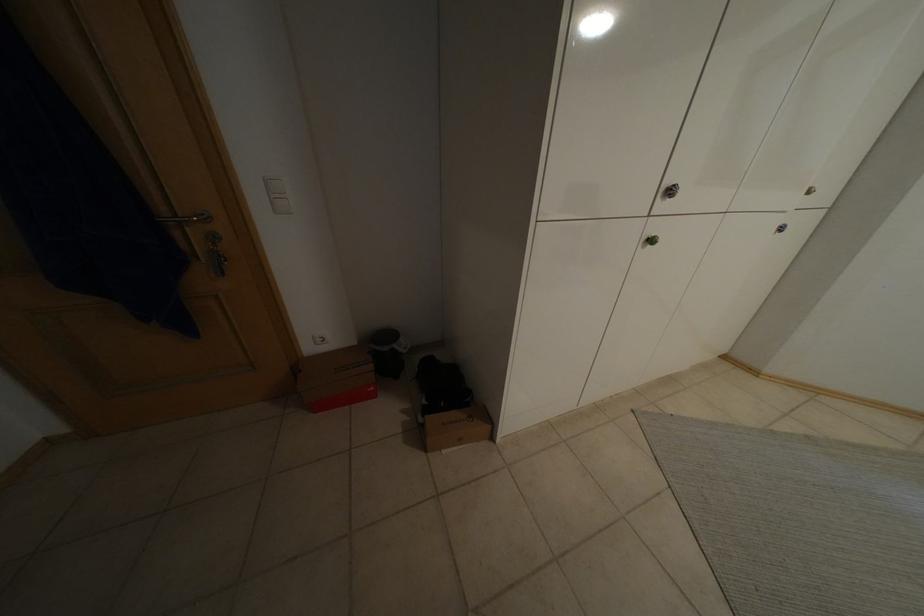
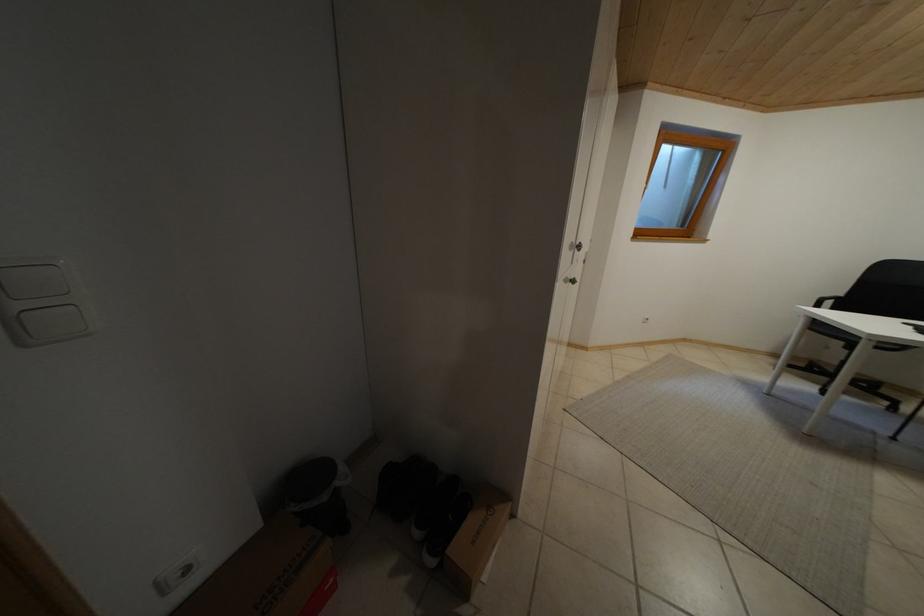
Question: The camera is either moving clockwise (left) or counter-clockwise (right) around the object. The first image is from the beginning of the video and the second image is from the end. Is the camera moving left or right when shooting the video?

Choices:
 (A) Left
 (B) Right

Answer: (A)